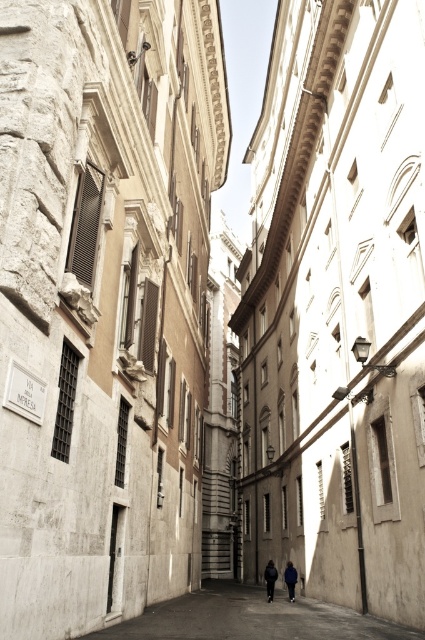
Who is taller, concrete alley at center or dark blue jacket at center?

concrete alley at center is taller.

Is concrete alley at center positioned behind dark blue jacket at center?

No, it is not.

Does point (212, 593) lie in front of point (275, 579)?

No.

Identify the location of concrete alley at center. (249, 618).

Looking at this image, does concrete alley at center appear on the left side of blue fabric jacket at center?

Correct, you'll find concrete alley at center to the left of blue fabric jacket at center.

Does concrete alley at center have a greater height compared to blue fabric jacket at center?

Yes, concrete alley at center is taller than blue fabric jacket at center.

Locate an element on the screen. concrete alley at center is located at coordinates (249, 618).

Locate an element on the screen. concrete alley at center is located at coordinates (249, 618).

Does point (269, 564) come in front of point (291, 573)?

No, it is behind (291, 573).

I want to click on dark blue jacket at center, so click(269, 579).